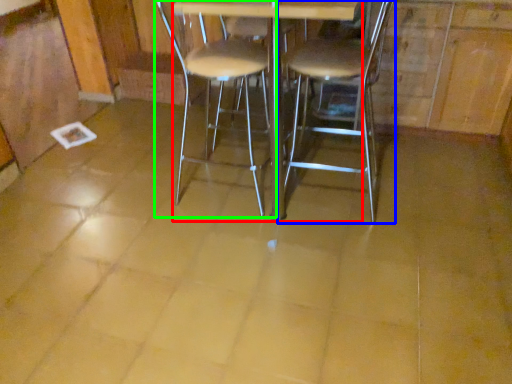
Question: Which object is positioned farthest from round table (highlighted by a red box)? Select from chair (highlighted by a blue box) and chair (highlighted by a green box).

Choices:
 (A) chair
 (B) chair

Answer: (B)